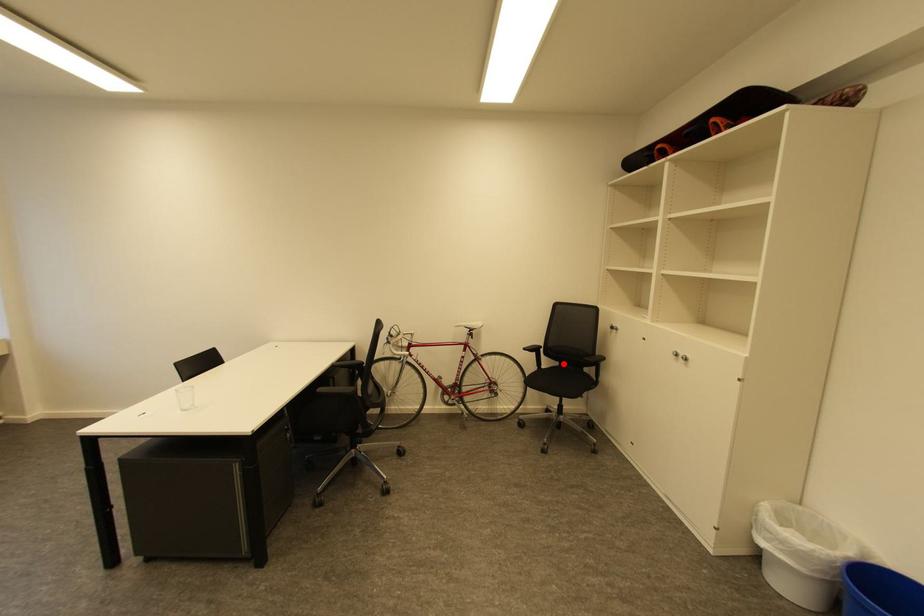
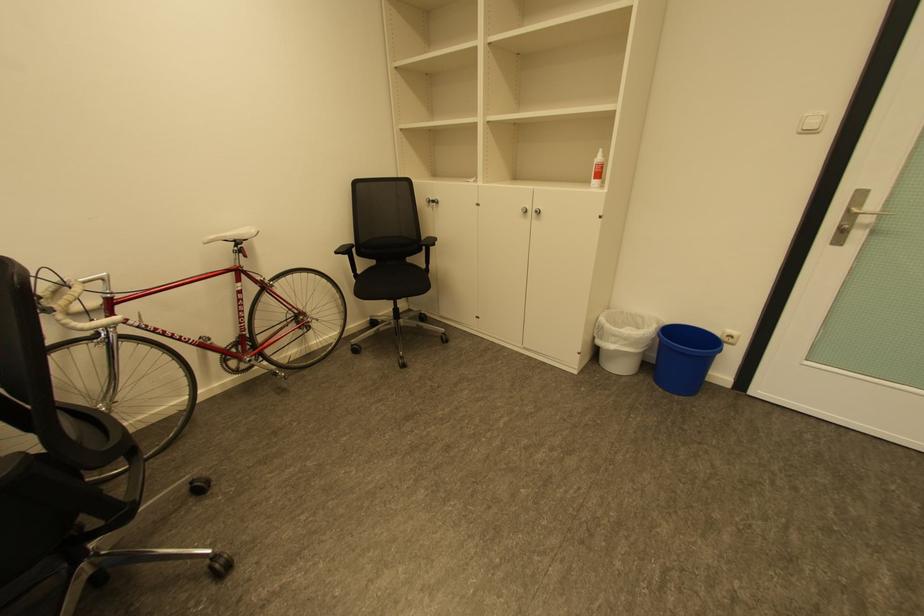
Question: I am providing you with two images of the same scene from different viewpoints. In image1, a red point is highlighted. Considering the same 3D point in image2, which of the following is correct?

Choices:
 (A) It is closer
 (B) It is farther

Answer: (A)